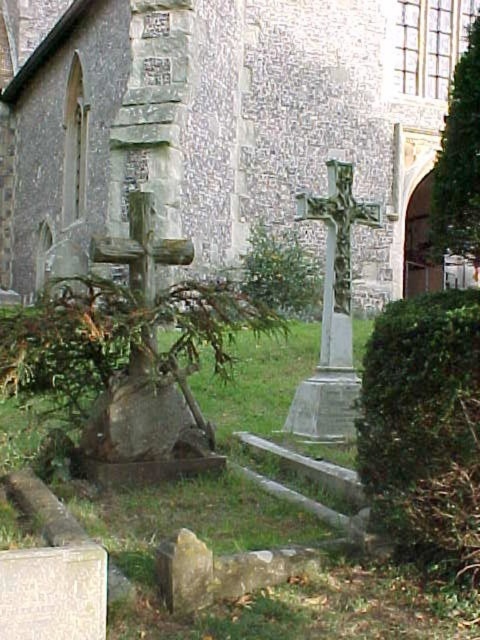
You are an architect analyzing the churchyard layout. You need to determine the relative sizes of the stone church at center and the green leafy tree at upper right. Based on the scene, which one is wider?

The stone church at center is wider than the green leafy tree at upper right according to the description.

You are standing in the churchyard and want to take a photo of the stone church at center and the green leafy tree at upper right. Which object should you focus on first to ensure both are in the frame?

You should focus on the stone church at center first because it is closer to you than the green leafy tree at upper right, so adjusting the camera to include it will naturally include the tree in the background.